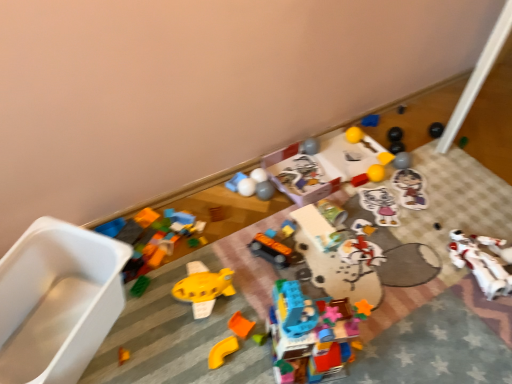
Image resolution: width=512 pixels, height=384 pixels. In order to click on vacant area situated to the left side of translucent plastic building blocks at center, the 9th toy positioned from the left in this screenshot , I will do `click(236, 342)`.